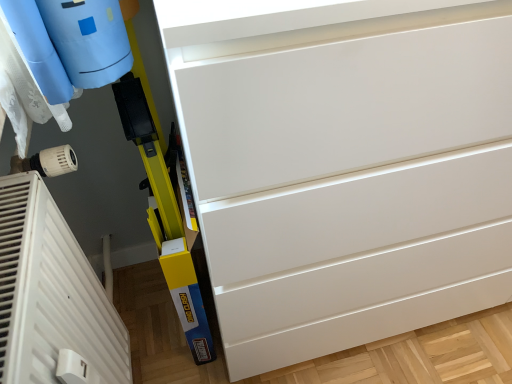
Where is `blank space situated above white matte radiator at left (from a real-world perspective)`? This screenshot has width=512, height=384. blank space situated above white matte radiator at left (from a real-world perspective) is located at coordinates (19, 235).